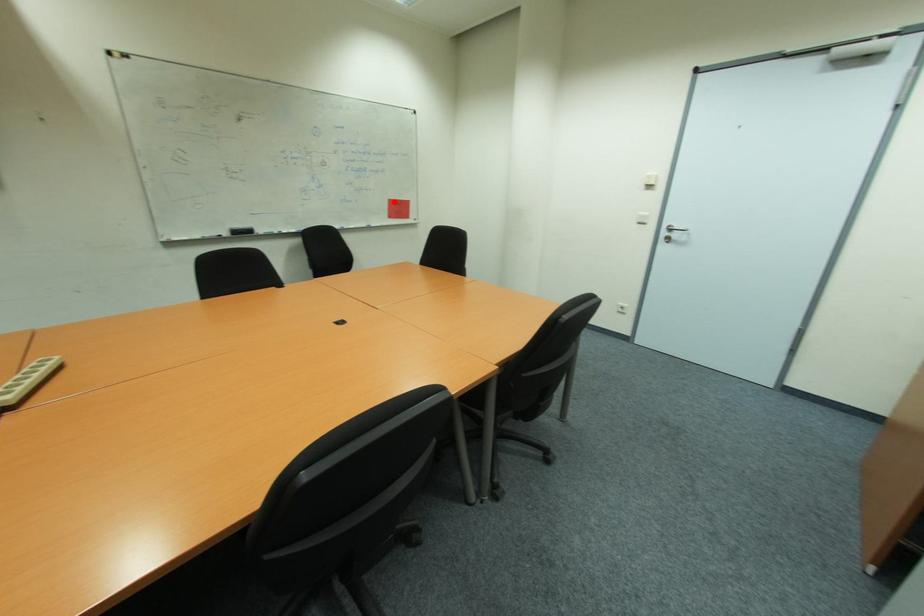
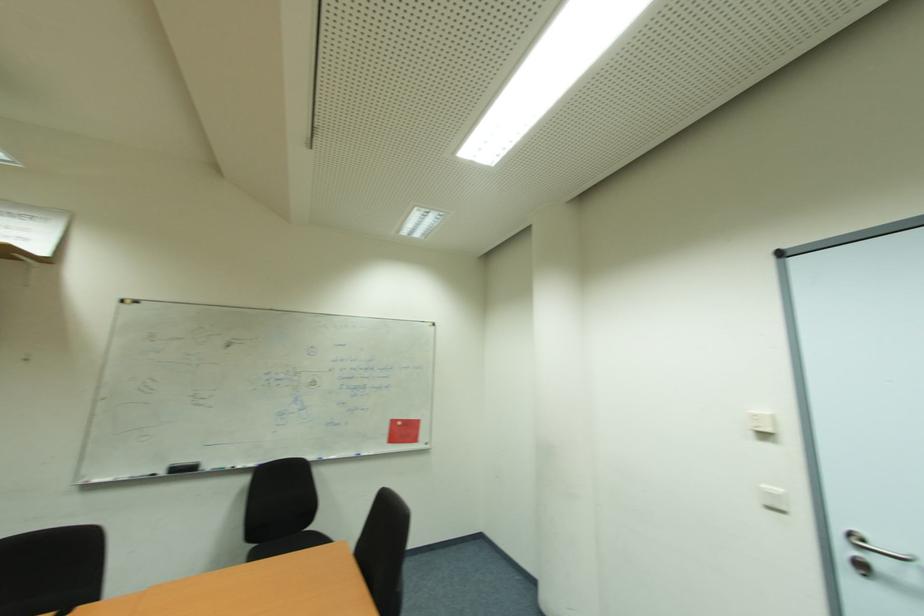
Find the pixel in the second image that matches the highlighted location in the first image.

(397, 423)